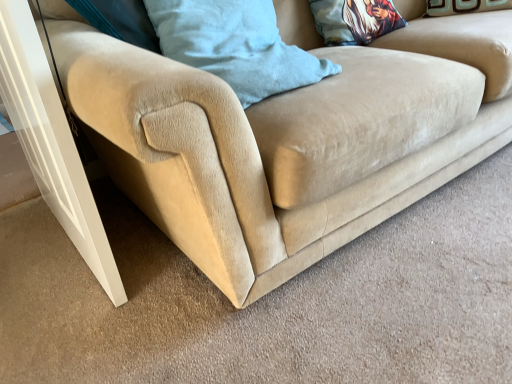
Question: Visually, is printed fabric pillow at upper center, arranged as the second pillow when viewed from the left, positioned to the left or to the right of white glossy screen door at lower left?

Choices:
 (A) left
 (B) right

Answer: (B)

Question: In terms of size, does printed fabric pillow at upper center, the 2th pillow when ordered from front to back, appear bigger or smaller than white glossy screen door at lower left?

Choices:
 (A) big
 (B) small

Answer: (B)

Question: Which object is the closest to the printed fabric pillow at upper center, the 2th pillow when ordered from front to back?

Choices:
 (A) white glossy screen door at lower left
 (B) corduroy blue pillow at upper center, marked as the 1th pillow in a left-to-right arrangement

Answer: (B)

Question: Based on their relative distances, which object is nearer to the printed fabric pillow at upper center, the 2th pillow when ordered from front to back?

Choices:
 (A) white glossy screen door at lower left
 (B) corduroy blue pillow at upper center, the 2th pillow positioned from the right

Answer: (B)